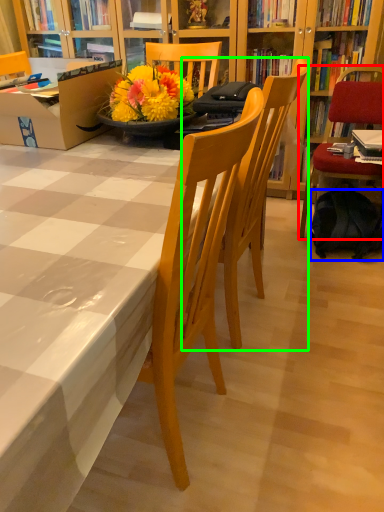
Question: Based on their relative distances, which object is farther from chair (highlighted by a red box)? Choose from backpack (highlighted by a blue box) and chair (highlighted by a green box).

Choices:
 (A) backpack
 (B) chair

Answer: (B)